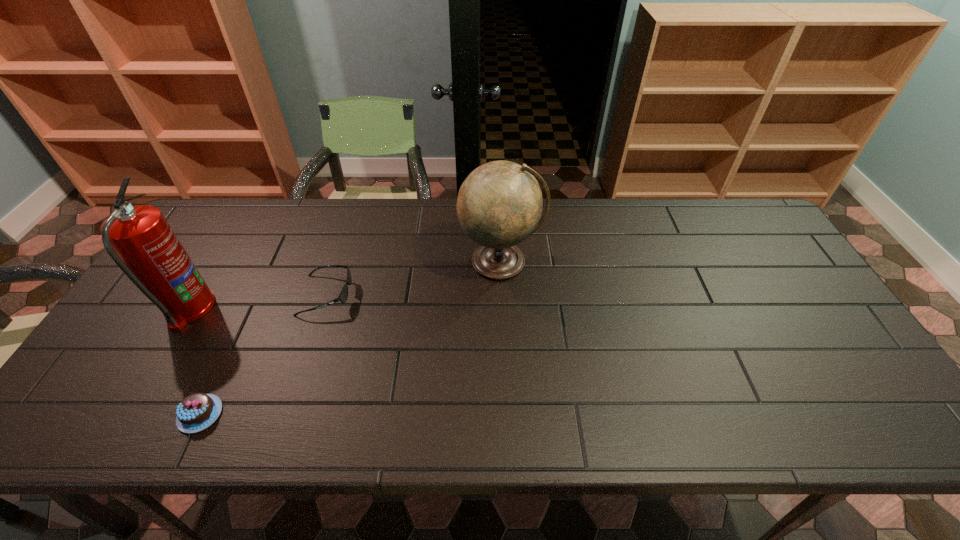
Identify the location of object present at the near edge. The width and height of the screenshot is (960, 540). (196, 412).

Locate an element on the screen. The width and height of the screenshot is (960, 540). object positioned at the left edge is located at coordinates (139, 240).

In the image, there is a desktop. Identify the location of vacant space at the far edge. (441, 217).

Locate an element on the screen. vacant space at the near edge of the desktop is located at coordinates (174, 428).

In the image, there is a desktop. At what (x,y) coordinates should I click in order to perform the action: click on blank space at the right edge. Please return your answer as a coordinate pair (x, y). The width and height of the screenshot is (960, 540). Looking at the image, I should click on (800, 297).

Find the location of a particular element. unoccupied position between the third object from right to left and the leftmost object is located at coordinates (195, 361).

Find the location of a particular element. empty space that is in between the third object from left to right and the shortest object is located at coordinates (263, 355).

Where is `empty space between the shortest object and the fire extinguisher`? empty space between the shortest object and the fire extinguisher is located at coordinates (195, 361).

The height and width of the screenshot is (540, 960). I want to click on free area in between the sunglasses and the third object from right to left, so click(263, 355).

At what (x,y) coordinates should I click in order to perform the action: click on free area in between the sunglasses and the globe. Please return your answer as a coordinate pair (x, y). The width and height of the screenshot is (960, 540). Looking at the image, I should click on (414, 279).